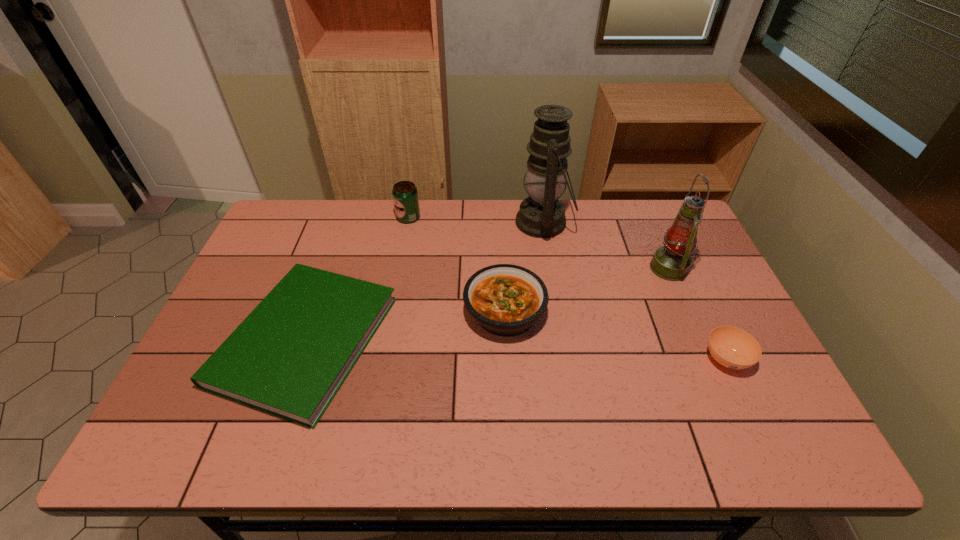
This screenshot has height=540, width=960. I want to click on object at the near left corner, so click(x=289, y=357).

Identify the location of vacant space at the far edge of the desktop. The width and height of the screenshot is (960, 540). (602, 217).

Image resolution: width=960 pixels, height=540 pixels. I want to click on vacant area at the near edge, so click(x=384, y=436).

In the image, there is a desktop. At what (x,y) coordinates should I click in order to perform the action: click on vacant space at the left edge. Please return your answer as a coordinate pair (x, y). The width and height of the screenshot is (960, 540). Looking at the image, I should click on (299, 264).

Identify the location of free region at the right edge of the desktop. (704, 284).

Where is `vacant space at the far left corner of the desktop`? The height and width of the screenshot is (540, 960). vacant space at the far left corner of the desktop is located at coordinates (316, 220).

In the image, there is a desktop. At what (x,y) coordinates should I click in order to perform the action: click on free space at the far right corner. Please return your answer as a coordinate pair (x, y). This screenshot has height=540, width=960. Looking at the image, I should click on pos(654,215).

Locate an element on the screen. The image size is (960, 540). empty location between the shortest object and the soup bowl is located at coordinates (516, 349).

You are a GUI agent. You are given a task and a screenshot of the screen. Output one action in this format:
    pyautogui.click(x=<x>, y=<y>)
    Task: Click on the free point between the soup bowl and the beer can
    Image resolution: width=960 pixels, height=540 pixels.
    Given the screenshot: What is the action you would take?
    pyautogui.click(x=567, y=288)

Where is `vacant region between the soup bowl and the stew`? vacant region between the soup bowl and the stew is located at coordinates click(x=615, y=335).